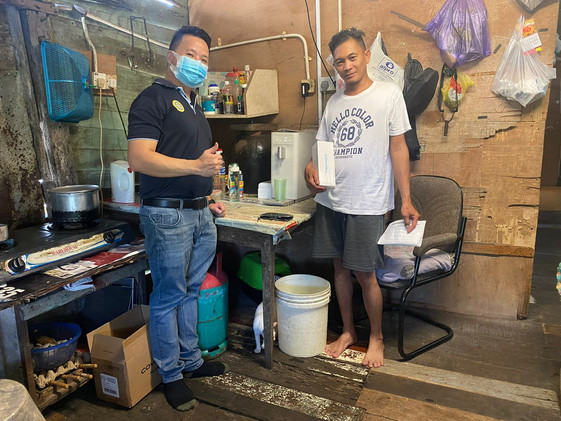
Locate an element on the screen. This screenshot has height=421, width=561. chair is located at coordinates click(x=446, y=206).